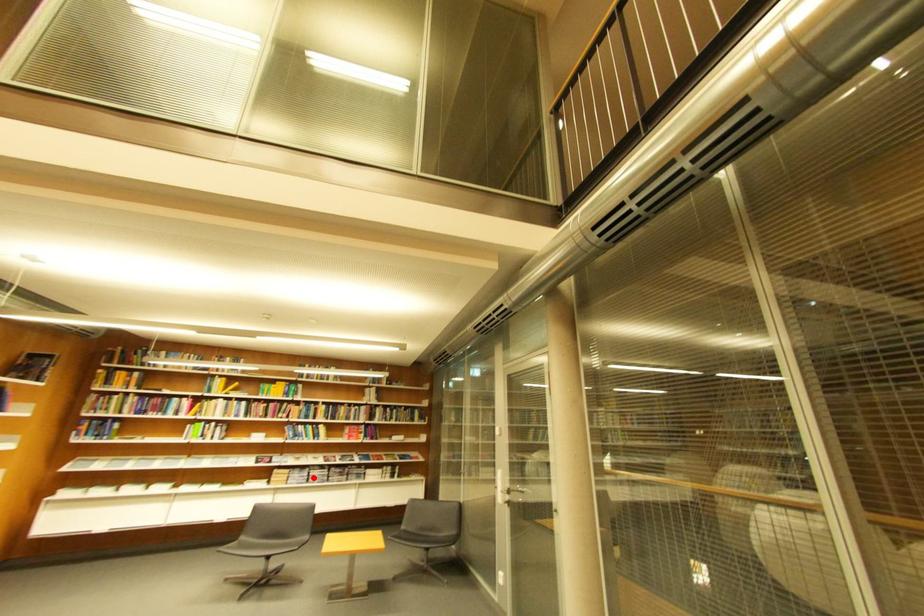
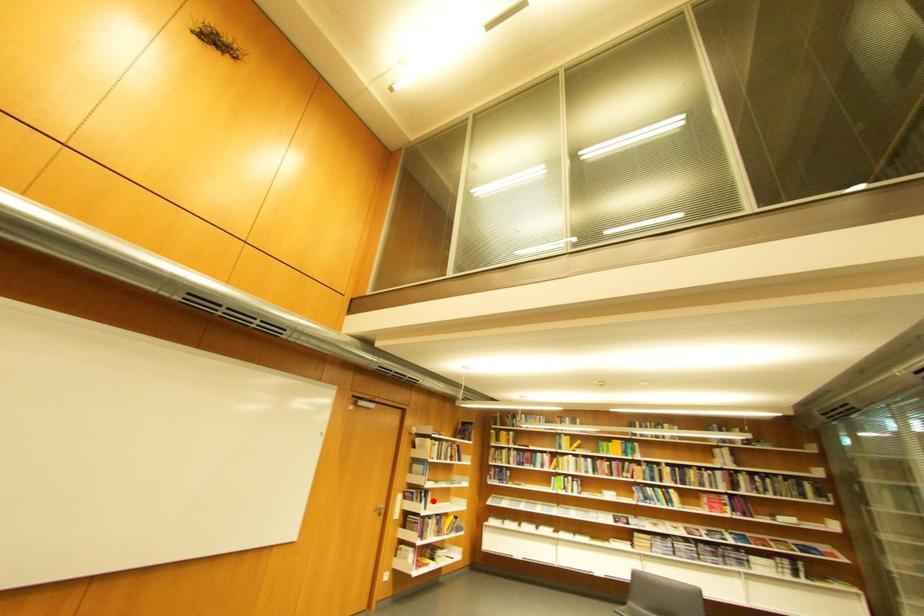
I am providing you with two images of the same scene from different viewpoints. A red point is marked on the first image and another point is marked on the second image. Do the highlighted points in image1 and image2 indicate the same real-world spot?

No